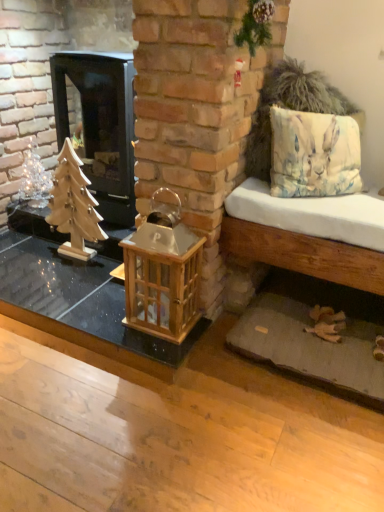
Question: Is wooden christmas tree at left surrounded by light brown wooden bench at right?

Choices:
 (A) yes
 (B) no

Answer: (B)

Question: Does light brown wooden bench at right come behind wooden christmas tree at left?

Choices:
 (A) no
 (B) yes

Answer: (A)

Question: Does light brown wooden bench at right have a smaller size compared to wooden christmas tree at left?

Choices:
 (A) no
 (B) yes

Answer: (A)

Question: Considering the relative sizes of light brown wooden bench at right and wooden christmas tree at left in the image provided, is light brown wooden bench at right taller than wooden christmas tree at left?

Choices:
 (A) no
 (B) yes

Answer: (B)

Question: From the image's perspective, is light brown wooden bench at right located beneath wooden christmas tree at left?

Choices:
 (A) yes
 (B) no

Answer: (A)

Question: Is wooden christmas tree at left at the back of light brown wooden bench at right?

Choices:
 (A) yes
 (B) no

Answer: (B)

Question: Is shiny silver christmas tree at left thinner than light brown wooden bench at right?

Choices:
 (A) no
 (B) yes

Answer: (B)

Question: Can you confirm if shiny silver christmas tree at left is bigger than light brown wooden bench at right?

Choices:
 (A) yes
 (B) no

Answer: (B)

Question: From a real-world perspective, is shiny silver christmas tree at left over light brown wooden bench at right?

Choices:
 (A) no
 (B) yes

Answer: (B)

Question: From the image's perspective, is shiny silver christmas tree at left located above light brown wooden bench at right?

Choices:
 (A) yes
 (B) no

Answer: (A)

Question: Considering the relative positions of shiny silver christmas tree at left and light brown wooden bench at right in the image provided, is shiny silver christmas tree at left to the left of light brown wooden bench at right from the viewer's perspective?

Choices:
 (A) yes
 (B) no

Answer: (A)

Question: From the image's perspective, is shiny silver christmas tree at left beneath light brown wooden bench at right?

Choices:
 (A) yes
 (B) no

Answer: (B)

Question: Is light brown wooden bench at right oriented towards wooden table at center?

Choices:
 (A) yes
 (B) no

Answer: (B)